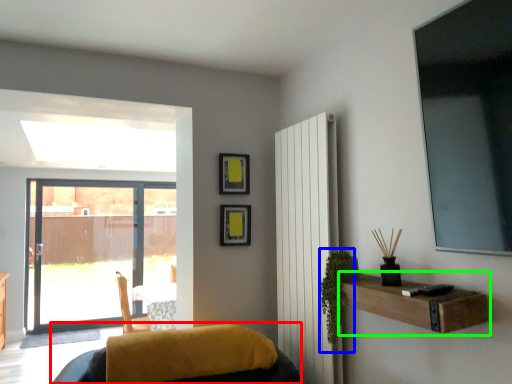
Question: Considering the real-world distances, which object is farthest from furniture (highlighted by a red box)? plant (highlighted by a blue box) or shelf (highlighted by a green box)?

Choices:
 (A) plant
 (B) shelf

Answer: (B)